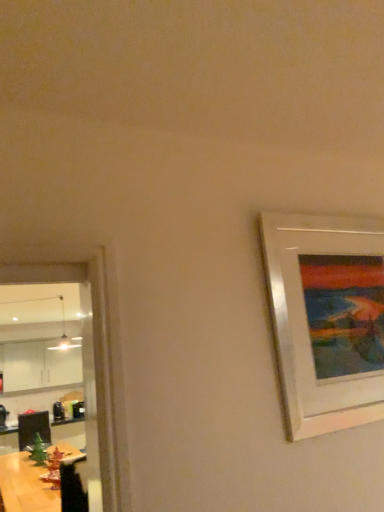
Where is `wooden table at lower left`? The image size is (384, 512). wooden table at lower left is located at coordinates (26, 485).

What do you see at coordinates (26, 485) in the screenshot? I see `wooden table at lower left` at bounding box center [26, 485].

Measure the distance between white glossy picture frame at right and camera.

They are 1.41 meters apart.

Describe the element at coordinates (326, 319) in the screenshot. I see `white glossy picture frame at right` at that location.

Identify the location of white glossy picture frame at right. This screenshot has width=384, height=512. coord(326,319).

This screenshot has height=512, width=384. Find the location of `wooden table at lower left`. wooden table at lower left is located at coordinates (26, 485).

Considering the positions of objects wooden table at lower left and white glossy picture frame at right in the image provided, who is more to the left, wooden table at lower left or white glossy picture frame at right?

wooden table at lower left is more to the left.

Between wooden table at lower left and white glossy picture frame at right, which one is positioned behind?

Positioned behind is wooden table at lower left.

Which is in front, point (33, 498) or point (303, 414)?

Point (303, 414)

From the image's perspective, relative to white glossy picture frame at right, is wooden table at lower left above or below?

wooden table at lower left is situated lower than white glossy picture frame at right in the image.

From a real-world perspective, is wooden table at lower left positioned above or below white glossy picture frame at right?

wooden table at lower left is situated lower than white glossy picture frame at right in the real world.

Can you confirm if wooden table at lower left is thinner than white glossy picture frame at right?

In fact, wooden table at lower left might be wider than white glossy picture frame at right.

Who is taller, wooden table at lower left or white glossy picture frame at right?

white glossy picture frame at right is taller.

Which of these two, wooden table at lower left or white glossy picture frame at right, is bigger?

With larger size is wooden table at lower left.

Which is correct: wooden table at lower left is inside white glossy picture frame at right, or outside of it?

wooden table at lower left is located beyond the bounds of white glossy picture frame at right.

Is wooden table at lower left not near white glossy picture frame at right?

Absolutely, wooden table at lower left is distant from white glossy picture frame at right.

Is wooden table at lower left facing towards white glossy picture frame at right?

No, wooden table at lower left is not facing towards white glossy picture frame at right.

How many degrees apart are the facing directions of wooden table at lower left and white glossy picture frame at right?

The angle between the facing direction of wooden table at lower left and the facing direction of white glossy picture frame at right is 92.7 degrees.

The width and height of the screenshot is (384, 512). I want to click on table below the white glossy picture frame at right (from the image's perspective), so click(26, 485).

Is white glossy picture frame at right to the left of wooden table at lower left from the viewer's perspective?

Incorrect, white glossy picture frame at right is not on the left side of wooden table at lower left.

Which object is further away from the camera taking this photo, white glossy picture frame at right or wooden table at lower left?

wooden table at lower left is further from the camera.

Is point (286, 315) behind point (46, 502)?

No.

From the image's perspective, does white glossy picture frame at right appear lower than wooden table at lower left?

No, from the image's perspective, white glossy picture frame at right is not below wooden table at lower left.

From a real-world perspective, is white glossy picture frame at right physically below wooden table at lower left?

No, from a real-world perspective, white glossy picture frame at right is not beneath wooden table at lower left.

Does white glossy picture frame at right have a greater width compared to wooden table at lower left?

In fact, white glossy picture frame at right might be narrower than wooden table at lower left.

Can you confirm if white glossy picture frame at right is taller than wooden table at lower left?

Correct, white glossy picture frame at right is much taller as wooden table at lower left.

Can you confirm if white glossy picture frame at right is smaller than wooden table at lower left?

Indeed, white glossy picture frame at right has a smaller size compared to wooden table at lower left.

Can we say white glossy picture frame at right lies outside wooden table at lower left?

That's correct, white glossy picture frame at right is outside of wooden table at lower left.

Can you see white glossy picture frame at right touching wooden table at lower left?

No, white glossy picture frame at right is not touching wooden table at lower left.

Is white glossy picture frame at right looking in the opposite direction of wooden table at lower left?

Yes, wooden table at lower left is at the back of white glossy picture frame at right.

What's the angular difference between white glossy picture frame at right and wooden table at lower left's facing directions?

There is a 92.7-degree angle between the facing directions of white glossy picture frame at right and wooden table at lower left.

How much distance is there between white glossy picture frame at right and wooden table at lower left?

They are 2.63 meters apart.

Locate an element on the screen. The image size is (384, 512). table that is on the left side of white glossy picture frame at right is located at coordinates (26, 485).

Where is `table lying on the left of white glossy picture frame at right`? The width and height of the screenshot is (384, 512). table lying on the left of white glossy picture frame at right is located at coordinates (26, 485).

Locate an element on the screen. This screenshot has height=512, width=384. picture frame above the wooden table at lower left (from a real-world perspective) is located at coordinates (326, 319).